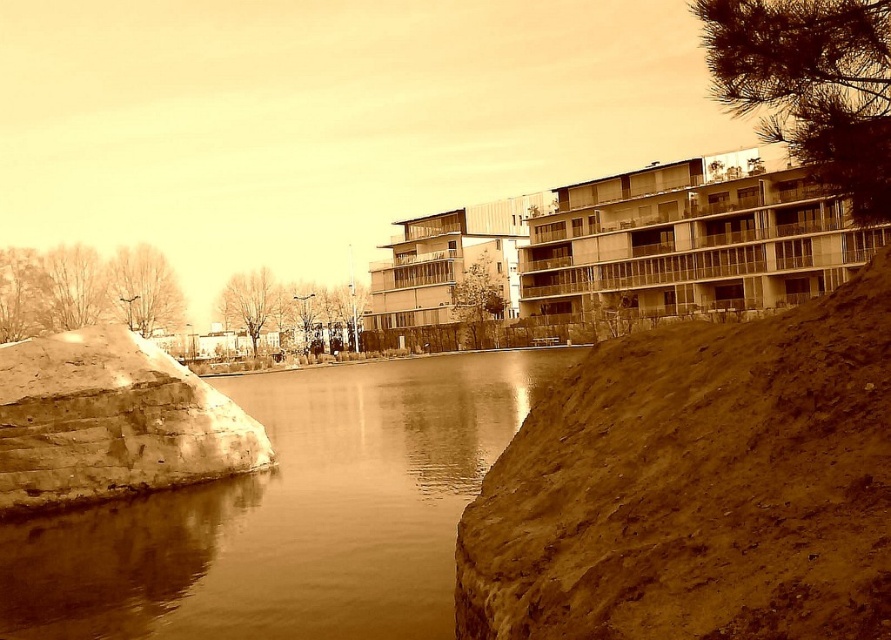
You are a photographer planning to capture the riverside scene. You want to ensure that the brown smooth water at center and the matte concrete building at center are both visible in your shot. Based on their widths, which object should you prioritize positioning closer to the edge of the frame to avoid overcrowding?

The brown smooth water at center has a lesser width compared to the matte concrete building at center. Therefore, you should prioritize positioning the brown smooth water at center closer to the edge of the frame to avoid overcrowding, as it takes up less space.

You are standing at the riverside and want to take a photo that includes both the brown smooth water at center and the matte concrete building at center. Which object should you focus on first to ensure both are in clear view?

You should focus on the brown smooth water at center first because it is closer to the viewer than the matte concrete building at center, so adjusting focus from near to far will help both be in clear view.

You are standing at the riverside and want to locate two specific points in the scene. The first point is at coordinates point (501, 442) and the second is at point (467, 221). Which of these points is nearer to you?

Point (501, 442) is closer to the viewer than point (467, 221).